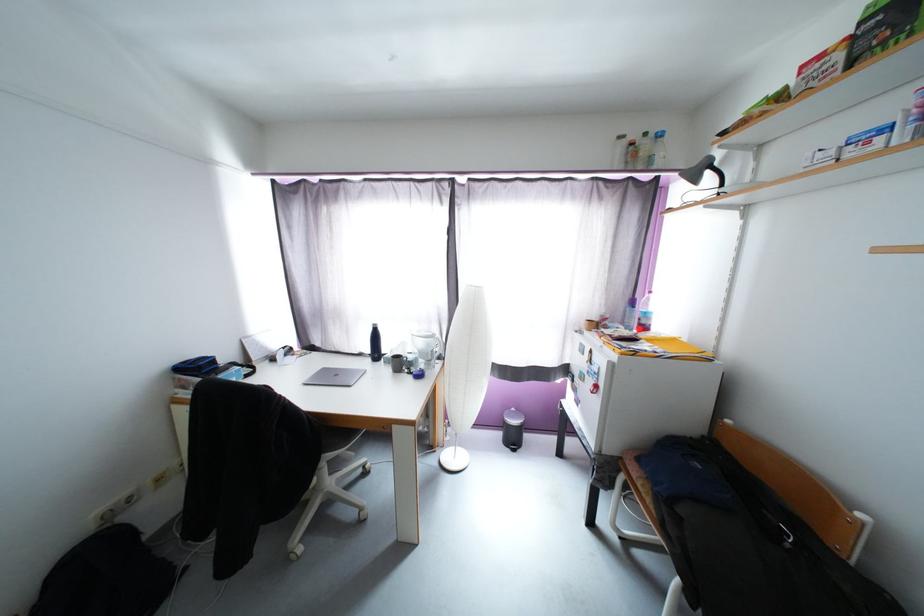
The location [513,429] corresponds to which object?

It refers to a small black trashcan.